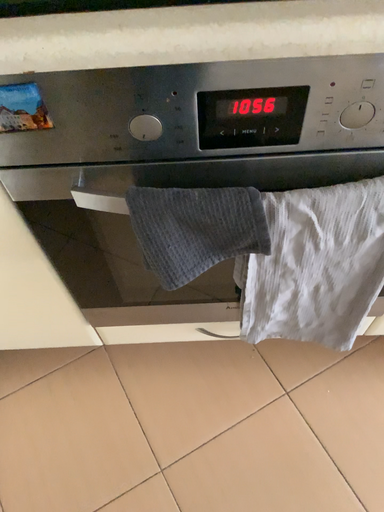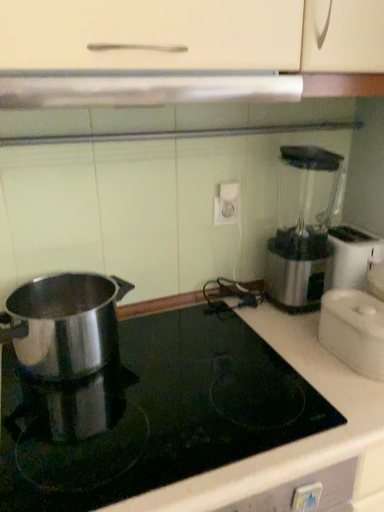
Question: How did the camera likely rotate when shooting the video?

Choices:
 (A) rotated right
 (B) rotated left

Answer: (A)